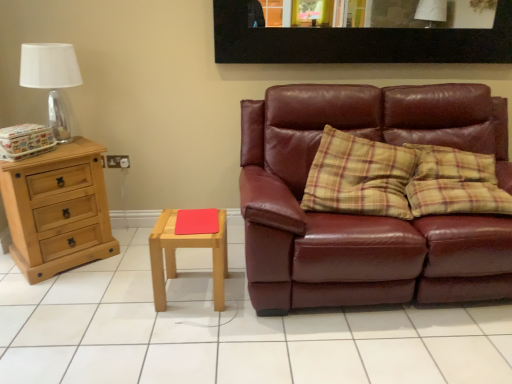
Locate an element on the screen. This screenshot has width=512, height=384. empty space that is ontop of light brown wooden stool at center is located at coordinates (190, 222).